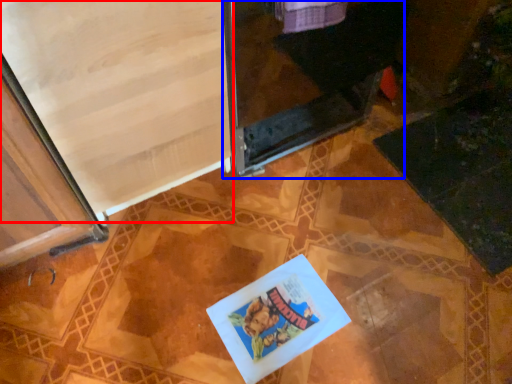
Question: Which object appears closest to the camera in this image, screen door (highlighted by a red box) or screen door (highlighted by a blue box)?

Choices:
 (A) screen door
 (B) screen door

Answer: (A)